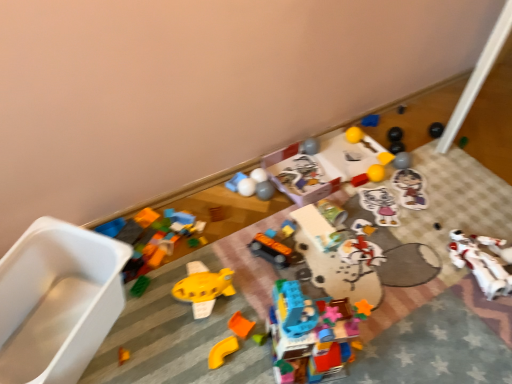
This screenshot has height=384, width=512. What are the coordinates of `free space on the front side of white matte ball at center, arranged as the 6th toy when viewed from the left` in the screenshot? It's located at (240, 222).